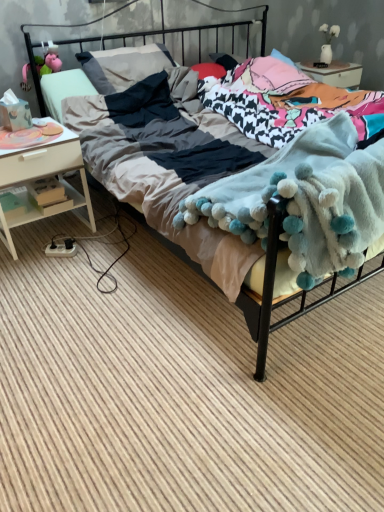
Image resolution: width=384 pixels, height=512 pixels. What are the coordinates of `free space in front of white wood nightstand at left` in the screenshot? It's located at (46, 273).